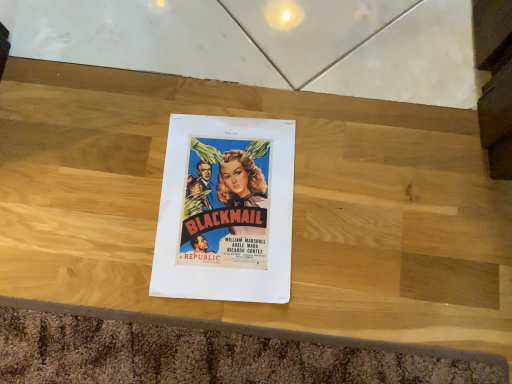
What do you see at coordinates (225, 210) in the screenshot? This screenshot has width=512, height=384. I see `matte paper poster at center` at bounding box center [225, 210].

Measure the distance between matte paper poster at center and camera.

matte paper poster at center is 25.04 inches from camera.

You are a GUI agent. You are given a task and a screenshot of the screen. Output one action in this format:
    pyautogui.click(x=<x>, y=<y>)
    Task: Click on the matte paper poster at center
    
    Given the screenshot: What is the action you would take?
    pyautogui.click(x=225, y=210)

Where is `matte paper poster at center`? Image resolution: width=512 pixels, height=384 pixels. matte paper poster at center is located at coordinates (225, 210).